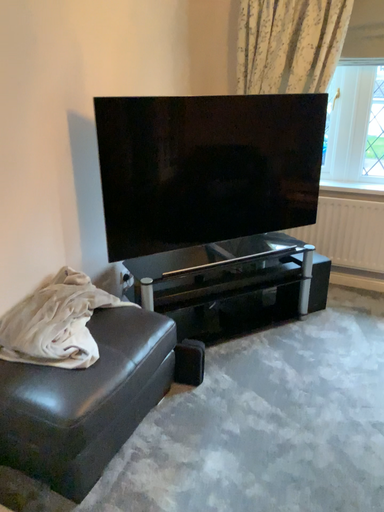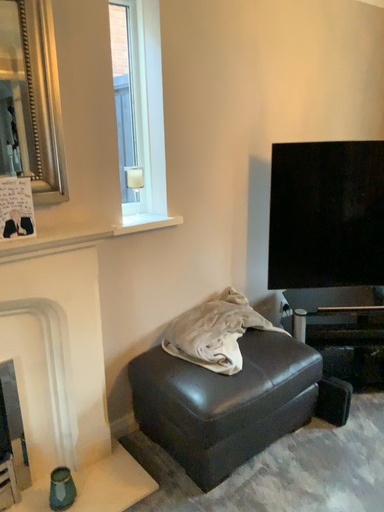
Question: How did the camera likely rotate when shooting the video?

Choices:
 (A) rotated upward
 (B) rotated downward

Answer: (A)